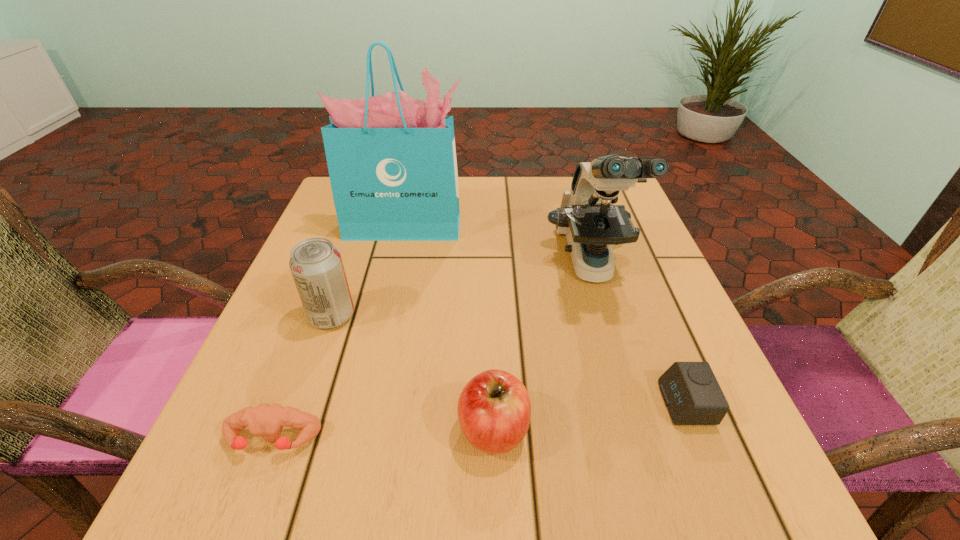
This screenshot has width=960, height=540. Find the location of `puncher located at the left edge`. puncher located at the left edge is located at coordinates (267, 420).

What are the coordinates of `microscope that is at the right edge` in the screenshot? It's located at (592, 224).

Find the location of `alarm clock at the right edge`. alarm clock at the right edge is located at coordinates (x=691, y=392).

The height and width of the screenshot is (540, 960). Find the location of `object that is positioned at the far left corner`. object that is positioned at the far left corner is located at coordinates (391, 158).

In order to click on object at the near left corner in this screenshot , I will do tap(267, 420).

You are a GUI agent. You are given a task and a screenshot of the screen. Output one action in this format:
    pyautogui.click(x=<x>, y=<y>)
    Task: Click on the blank space at the near edge of the desktop
    The height and width of the screenshot is (540, 960).
    Given the screenshot: What is the action you would take?
    pyautogui.click(x=595, y=499)

Image resolution: width=960 pixels, height=540 pixels. Find the location of `blank space at the left edge of the desktop`. blank space at the left edge of the desktop is located at coordinates (309, 441).

At what (x,y) coordinates should I click in order to perform the action: click on free spot at the right edge of the desktop. Please return your answer as a coordinate pair (x, y). The height and width of the screenshot is (540, 960). Looking at the image, I should click on (661, 359).

Find the location of a particular element. This screenshot has height=540, width=960. vacant region at the near left corner of the desktop is located at coordinates (320, 457).

The width and height of the screenshot is (960, 540). I want to click on free space between the puncher and the microscope, so tap(432, 353).